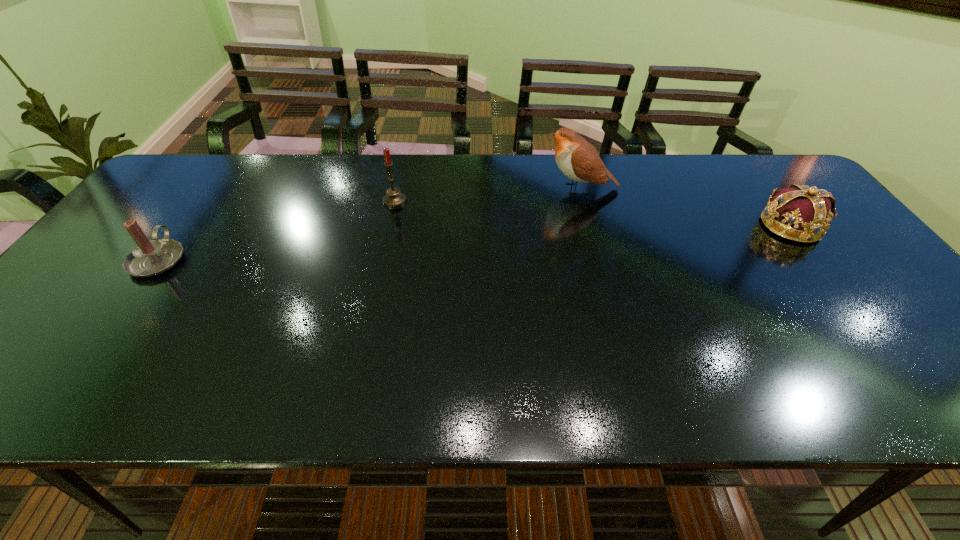
Where is `free space between the leftmost object and the taller candle`? The image size is (960, 540). free space between the leftmost object and the taller candle is located at coordinates (276, 230).

Identify the location of free spot between the farther candle and the bird. This screenshot has height=540, width=960. (488, 194).

The image size is (960, 540). In order to click on empty location between the rightmost object and the bird in this screenshot , I will do `click(685, 207)`.

The image size is (960, 540). What are the coordinates of `free space between the rightmost object and the farther candle` in the screenshot? It's located at (592, 213).

Choose which object is the third nearest neighbor to the left candle. Please provide its 2D coordinates. Your answer should be formatted as a tuple, i.e. [(x, y)], where the tuple contains the x and y coordinates of a point satisfying the conditions above.

[(802, 213)]

Select which object appears as the closest to the right candle. Please provide its 2D coordinates. Your answer should be formatted as a tuple, i.e. [(x, y)], where the tuple contains the x and y coordinates of a point satisfying the conditions above.

[(577, 159)]

Locate an element on the screen. The height and width of the screenshot is (540, 960). free space that satisfies the following two spatial constraints: 1. at the face of the rightmost object; 2. on the right side of the bird is located at coordinates (590, 226).

I want to click on vacant position in the image that satisfies the following two spatial constraints: 1. on the side of the shorter candle with the handle loop; 2. on the right side of the crown, so click(183, 226).

Find the location of a particular element. vacant region that satisfies the following two spatial constraints: 1. on the front side of the rightmost object; 2. on the left side of the taller candle is located at coordinates (389, 226).

Where is `free spot that satisfies the following two spatial constraints: 1. on the side of the second object from left to right with the handle loop; 2. on the left side of the left candle`? Image resolution: width=960 pixels, height=540 pixels. free spot that satisfies the following two spatial constraints: 1. on the side of the second object from left to right with the handle loop; 2. on the left side of the left candle is located at coordinates (202, 200).